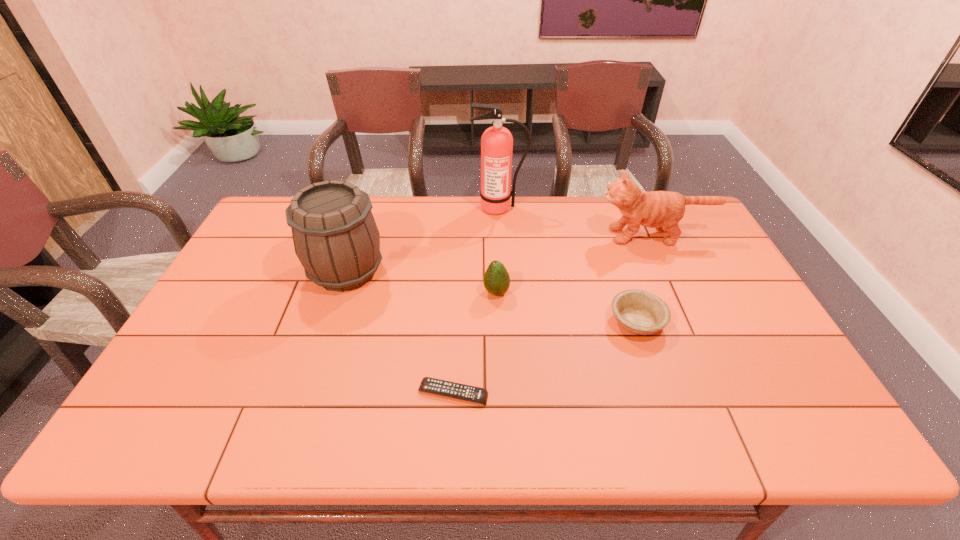
Locate an element on the screen. This screenshot has height=540, width=960. blank area in the image that satisfies the following two spatial constraints: 1. on the back side of the remote control; 2. on the left side of the avocado is located at coordinates (458, 293).